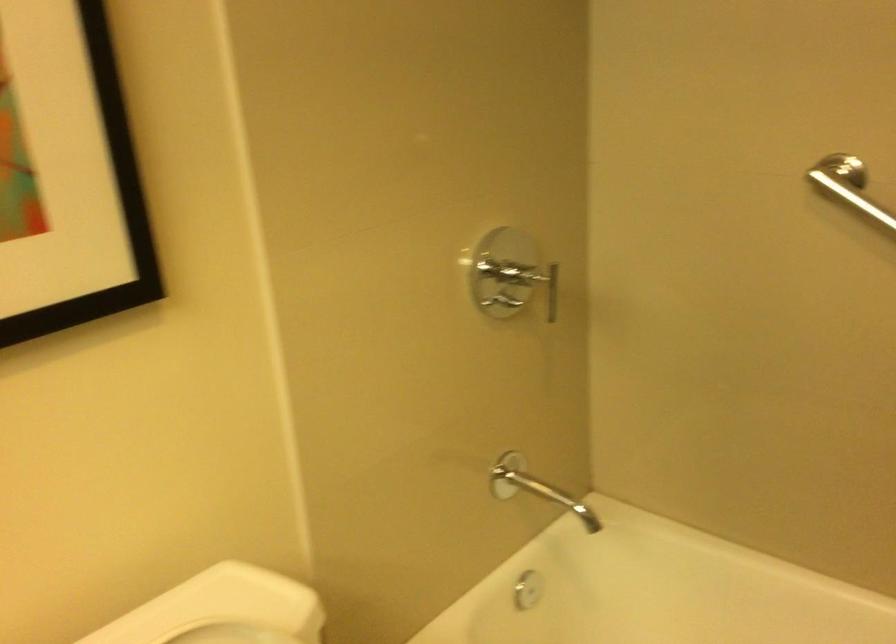
You are a GUI agent. You are given a task and a screenshot of the screen. Output one action in this format:
    pyautogui.click(x=<x>, y=<y>)
    Task: Click on the white toilet lid
    Image resolution: width=896 pixels, height=644 pixels.
    Given the screenshot: What is the action you would take?
    pyautogui.click(x=231, y=634)